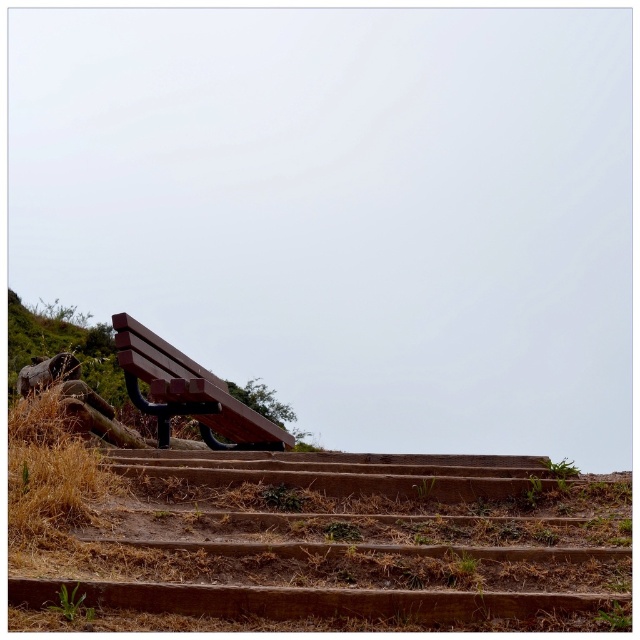
Can you confirm if brown wooden stairs at lower center is positioned below wooden bench at center?

Yes.

Between point (168, 563) and point (227, 387), which one is positioned in front?

Point (168, 563)

Where is `brown wooden stairs at lower center`? The width and height of the screenshot is (640, 640). brown wooden stairs at lower center is located at coordinates (342, 540).